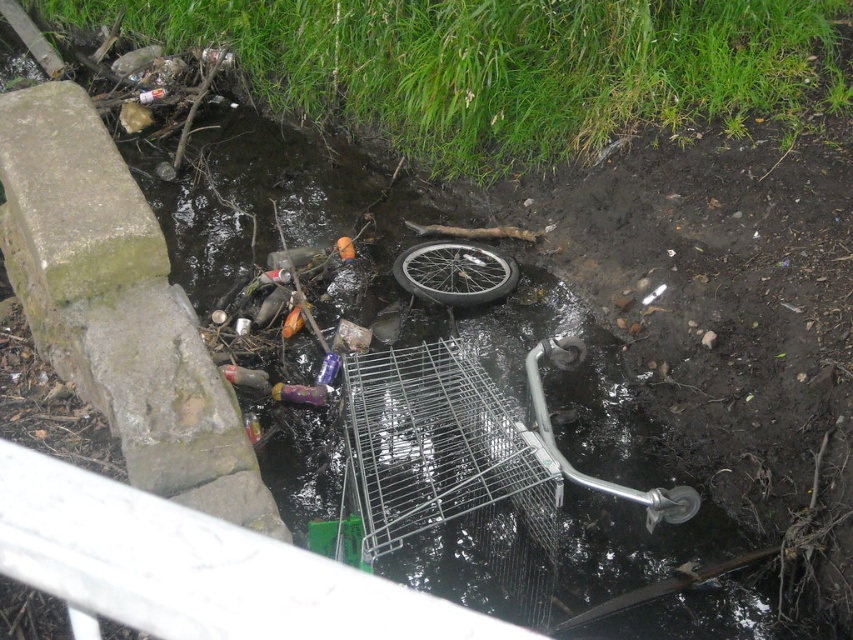
Question: Can you confirm if silver metallic cage at center is positioned below metallic silver bicycle wheel at center?

Choices:
 (A) no
 (B) yes

Answer: (B)

Question: Is silver metallic cage at center below metallic silver bicycle wheel at center?

Choices:
 (A) yes
 (B) no

Answer: (A)

Question: Which of the following is the farthest from the observer?

Choices:
 (A) silver metallic cage at center
 (B) metallic silver bicycle wheel at center

Answer: (B)

Question: Observing the image, what is the correct spatial positioning of silver metallic cage at center in reference to metallic silver bicycle wheel at center?

Choices:
 (A) above
 (B) below

Answer: (B)